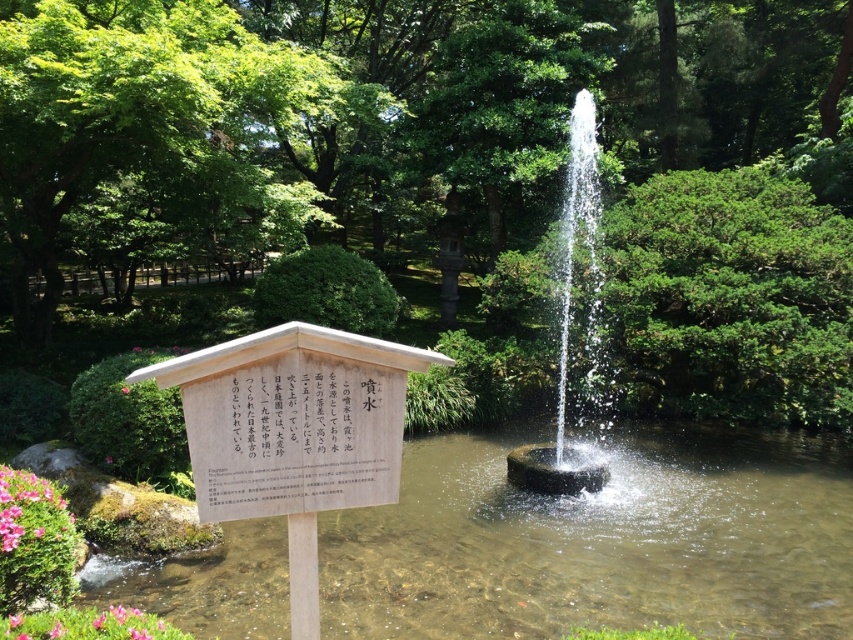
Question: Is pink matte flower at lower left above pink matte flower at center?

Choices:
 (A) yes
 (B) no

Answer: (B)

Question: Which object is farther from the camera taking this photo?

Choices:
 (A) green leafy tree at center
 (B) white paper sign at center
 (C) clear water fountain at center
 (D) pink matte flower at lower left

Answer: (C)

Question: Which object is positioned closest to the white paper sign at center?

Choices:
 (A) pink matte flower at center
 (B) green leafy tree at center

Answer: (A)

Question: Is pink matte flower at lower left bigger than pink matte flower at center?

Choices:
 (A) no
 (B) yes

Answer: (B)

Question: Can you confirm if green leafy tree at center is bigger than pink matte flower at lower left?

Choices:
 (A) no
 (B) yes

Answer: (B)

Question: Considering the real-world distances, which object is closest to the pink matte flower at center?

Choices:
 (A) green leafy tree at center
 (B) pink matte flower at lower left

Answer: (B)